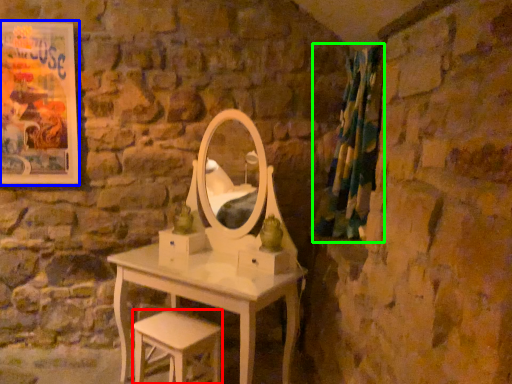
Question: Estimate the real-world distances between objects in this image. Which object is farther from stool (highlighted by a red box), picture frame (highlighted by a blue box) or curtain (highlighted by a green box)?

Choices:
 (A) picture frame
 (B) curtain

Answer: (A)